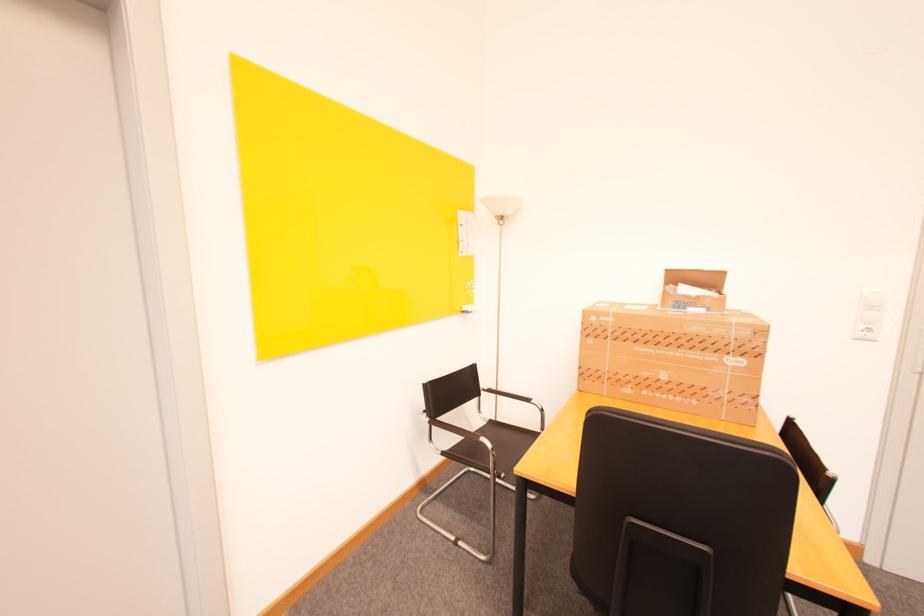
Locate an element on the screen. chair sitting surface is located at coordinates (506, 440).